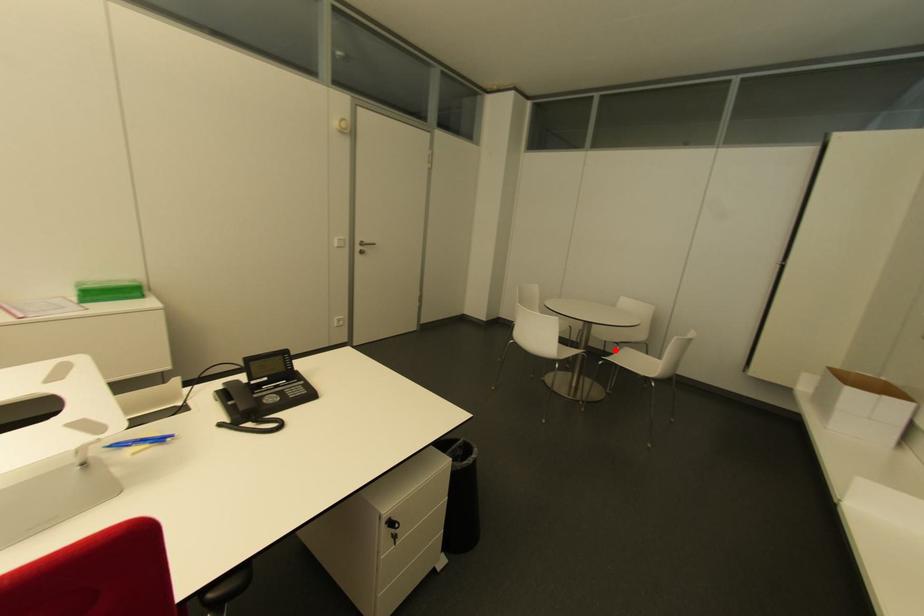
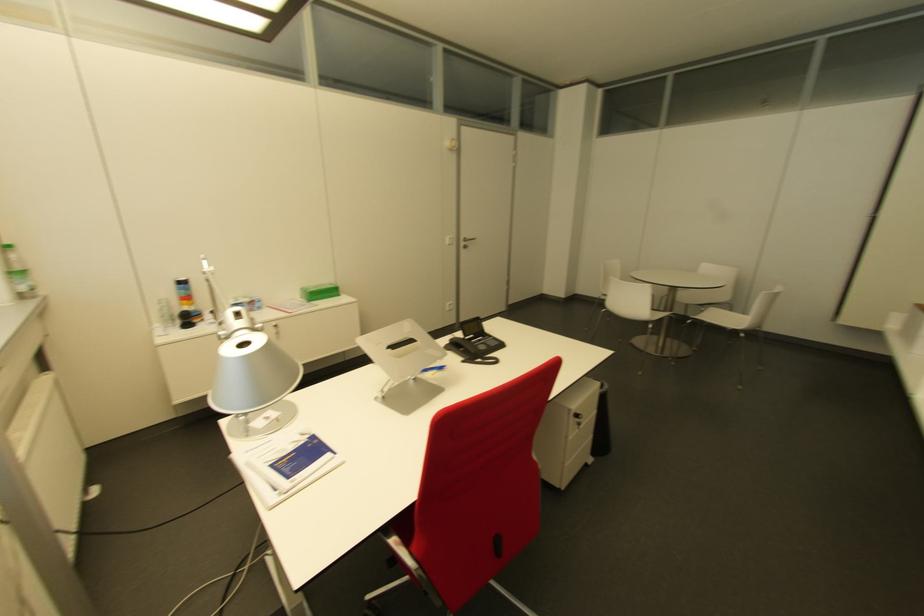
Question: I am providing you with two images of the same scene from different viewpoints. A red point is shown in image1. For the corresponding object point in image2, is it positioned nearer or farther from the camera?

Choices:
 (A) Nearer
 (B) Farther

Answer: (A)